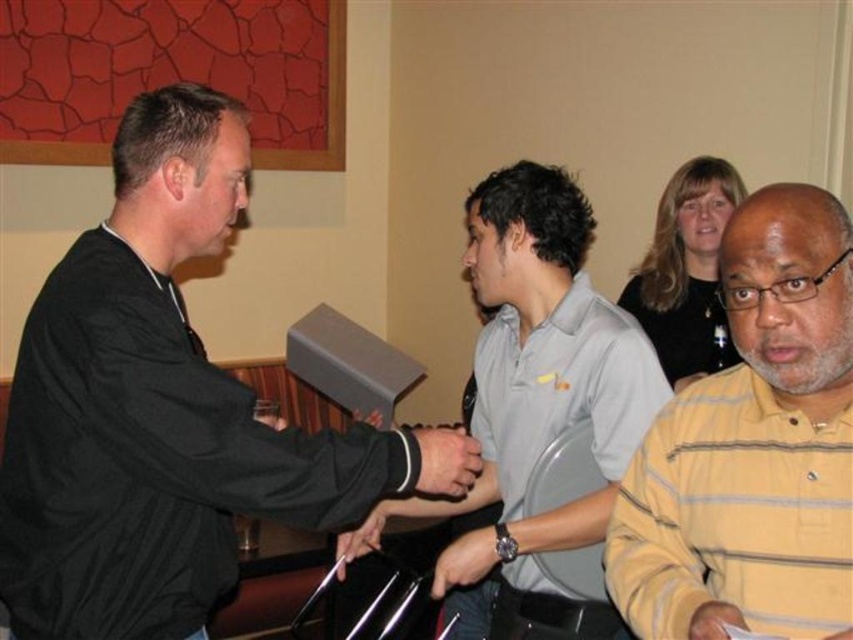
Which of these two, gray matte shirt at center or matte black hand at center, stands taller?

With more height is gray matte shirt at center.

Does point (494, 568) lie in front of point (451, 483)?

No, (494, 568) is further to viewer.

Find the location of `gray matte shirt at center`. gray matte shirt at center is located at coordinates (532, 388).

Which is below, black matte jacket at left or gray matte shirt at center?

gray matte shirt at center is lower down.

Does black matte jacket at left appear over gray matte shirt at center?

Yes, black matte jacket at left is above gray matte shirt at center.

Does point (125, 221) come farther from viewer compared to point (479, 227)?

No, (125, 221) is in front of (479, 227).

Where is `black matte jacket at left`? This screenshot has height=640, width=853. black matte jacket at left is located at coordinates (155, 408).

From the picture: Is black matte jacket at left smaller than matte black hand at center?

No, black matte jacket at left is not smaller than matte black hand at center.

Looking at this image, is black matte jacket at left positioned behind matte black hand at center?

No, black matte jacket at left is in front of matte black hand at center.

Identify the location of black matte jacket at left. (155, 408).